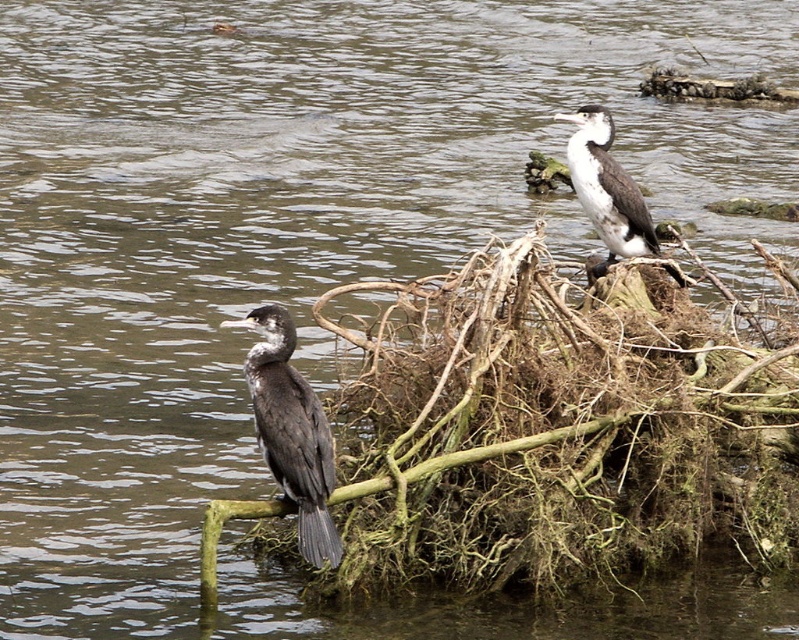
Which of these two, dark gray feathers at left or white-feathered bird at upper right, stands taller?

Standing taller between the two is white-feathered bird at upper right.

Does dark gray feathers at left appear over white-feathered bird at upper right?

Incorrect, dark gray feathers at left is not positioned above white-feathered bird at upper right.

Locate an element on the screen. This screenshot has height=640, width=799. dark gray feathers at left is located at coordinates (291, 432).

Is the position of brown fibrous nest at lower center less distant than that of dark gray feathers at left?

That is False.

Between point (527, 477) and point (267, 305), which one is positioned behind?

Positioned behind is point (267, 305).

Between point (644, 566) and point (261, 374), which one is positioned behind?

The point (644, 566) is behind.

Image resolution: width=799 pixels, height=640 pixels. What are the coordinates of `brown fibrous nest at lower center` in the screenshot? It's located at (557, 429).

Which is above, brown fibrous nest at lower center or white-feathered bird at upper right?

white-feathered bird at upper right is higher up.

Is brown fibrous nest at lower center below white-feathered bird at upper right?

Correct, brown fibrous nest at lower center is located below white-feathered bird at upper right.

Identify the location of brown fibrous nest at lower center. (557, 429).